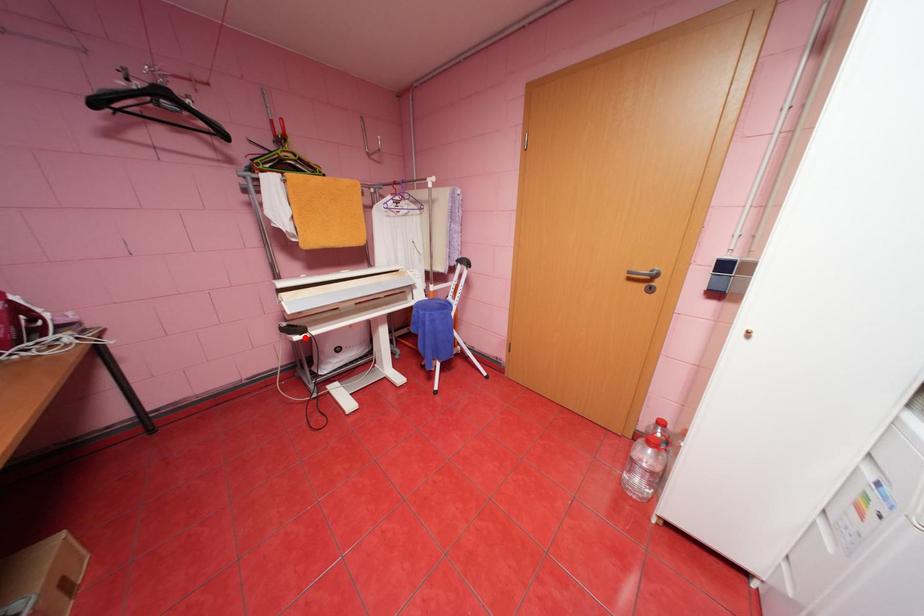
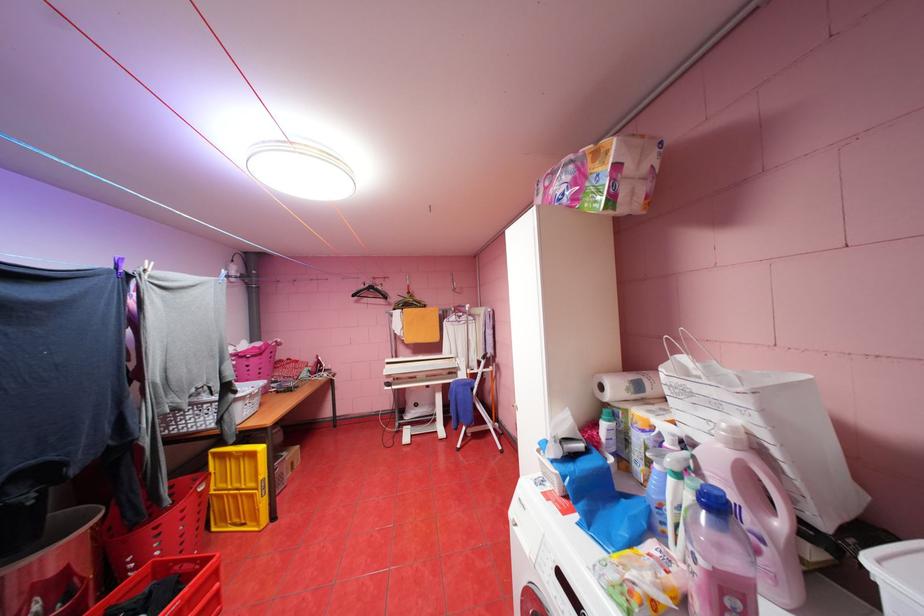
Locate, in the second image, the point that corresponds to the highlighted location in the first image.

(395, 387)